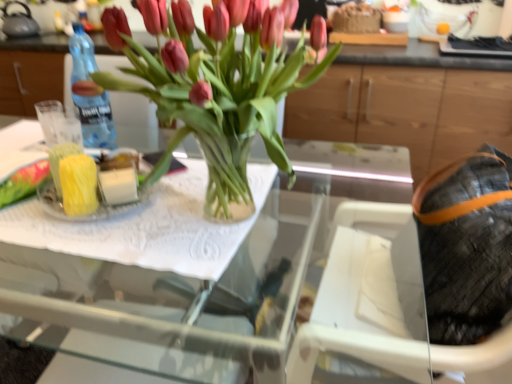
Question: Is matte gray kettle at upper left wider than blue plastic bottle at left?

Choices:
 (A) no
 (B) yes

Answer: (B)

Question: Is matte gray kettle at upper left looking in the opposite direction of blue plastic bottle at left?

Choices:
 (A) no
 (B) yes

Answer: (A)

Question: From a real-world perspective, is matte gray kettle at upper left below blue plastic bottle at left?

Choices:
 (A) yes
 (B) no

Answer: (B)

Question: Is matte gray kettle at upper left to the right of blue plastic bottle at left from the viewer's perspective?

Choices:
 (A) no
 (B) yes

Answer: (A)

Question: Can you confirm if matte gray kettle at upper left is thinner than blue plastic bottle at left?

Choices:
 (A) no
 (B) yes

Answer: (A)

Question: From a real-world perspective, is blue plastic bottle at left physically located above or below wooden cabinet at upper center?

Choices:
 (A) below
 (B) above

Answer: (B)

Question: From the image's perspective, relative to wooden cabinet at upper center, is blue plastic bottle at left above or below?

Choices:
 (A) above
 (B) below

Answer: (B)

Question: Is blue plastic bottle at left in front of or behind wooden cabinet at upper center in the image?

Choices:
 (A) behind
 (B) front

Answer: (B)

Question: Looking at the image, does blue plastic bottle at left seem bigger or smaller compared to wooden cabinet at upper center?

Choices:
 (A) big
 (B) small

Answer: (B)

Question: Looking at their shapes, would you say matte gray kettle at upper left is wider or thinner than blue plastic bottle at left?

Choices:
 (A) thin
 (B) wide

Answer: (B)

Question: Looking at the image, does matte gray kettle at upper left seem bigger or smaller compared to blue plastic bottle at left?

Choices:
 (A) big
 (B) small

Answer: (A)

Question: From a real-world perspective, is matte gray kettle at upper left positioned above or below blue plastic bottle at left?

Choices:
 (A) above
 (B) below

Answer: (A)

Question: Is matte gray kettle at upper left in front of or behind blue plastic bottle at left in the image?

Choices:
 (A) front
 (B) behind

Answer: (B)

Question: Is point (509, 258) positioned closer to the camera than point (503, 81)?

Choices:
 (A) farther
 (B) closer

Answer: (B)

Question: Considering the positions of leather textured bag at right and wooden cabinet at upper center in the image, is leather textured bag at right wider or thinner than wooden cabinet at upper center?

Choices:
 (A) wide
 (B) thin

Answer: (B)